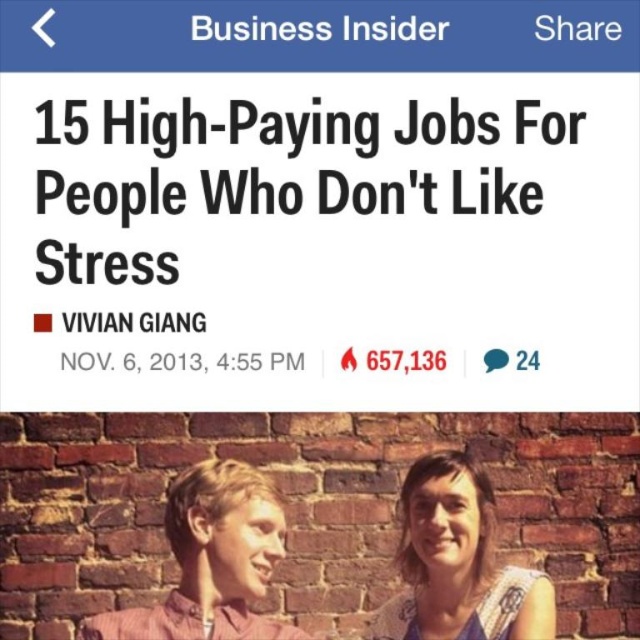
Is black text at upper center thinner than matte pink shirt at center?

No.

Who is positioned more to the left, black text at upper center or matte pink shirt at center?

matte pink shirt at center is more to the left.

What do you see at coordinates (115, 196) in the screenshot?
I see `black text at upper center` at bounding box center [115, 196].

The image size is (640, 640). In order to click on black text at upper center in this screenshot , I will do `click(115, 196)`.

Is point (220, 200) more distant than point (429, 500)?

Yes, point (220, 200) is behind point (429, 500).

Describe the element at coordinates (115, 196) in the screenshot. I see `black text at upper center` at that location.

This screenshot has height=640, width=640. I want to click on black text at upper center, so click(115, 196).

Based on the photo, between blue lace dress at center and matte pink shirt at center, which one appears on the left side from the viewer's perspective?

matte pink shirt at center

Which is behind, point (428, 481) or point (268, 506)?

The point (428, 481) is more distant.

Between point (516, 584) and point (170, 612), which one is positioned in front?

Point (170, 612) is more forward.

Identify the location of blue lace dress at center. (458, 563).